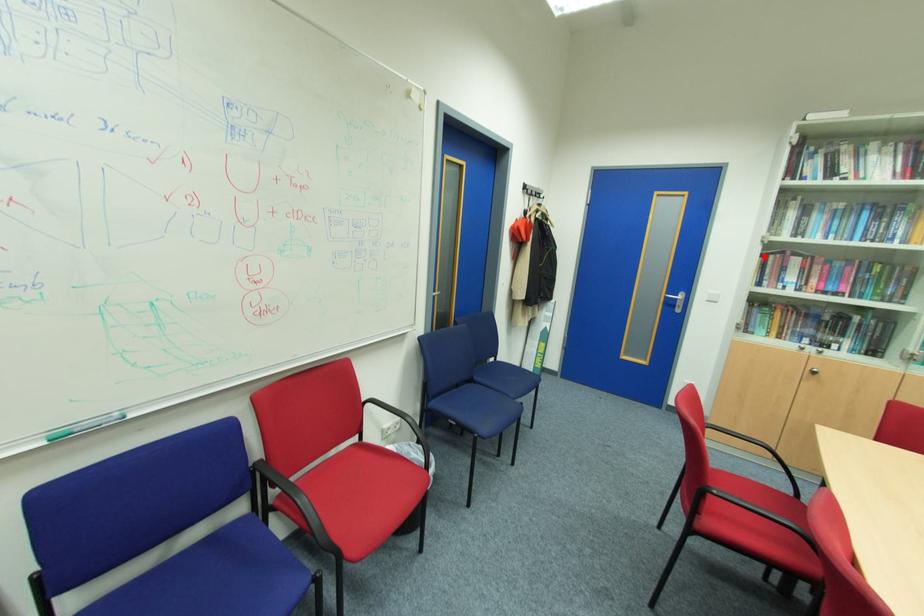
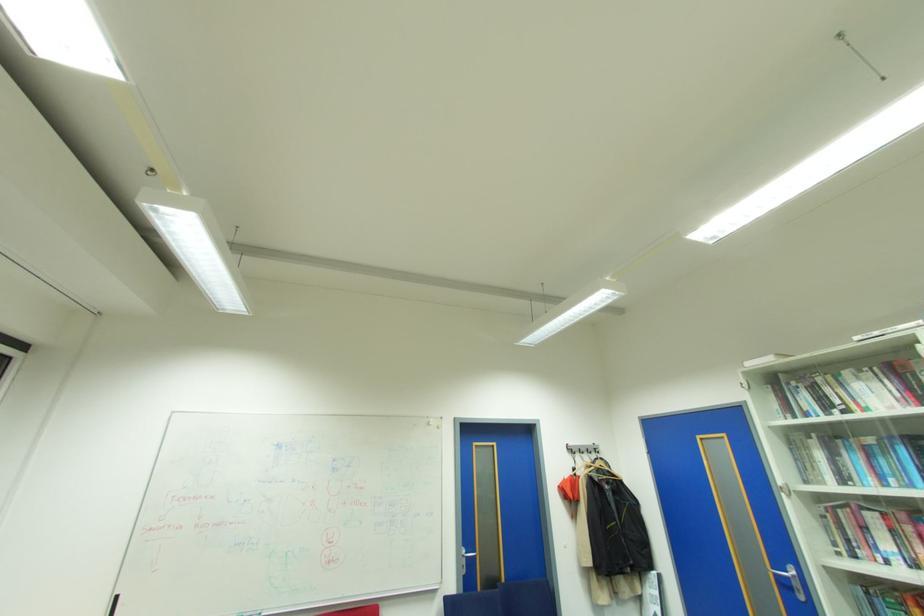
Question: I am providing you with two images of the same scene from different viewpoints. Given a red point in image1, look at the same physical point in image2. Is it:

Choices:
 (A) Closer to the viewpoint
 (B) Farther from the viewpoint

Answer: (A)